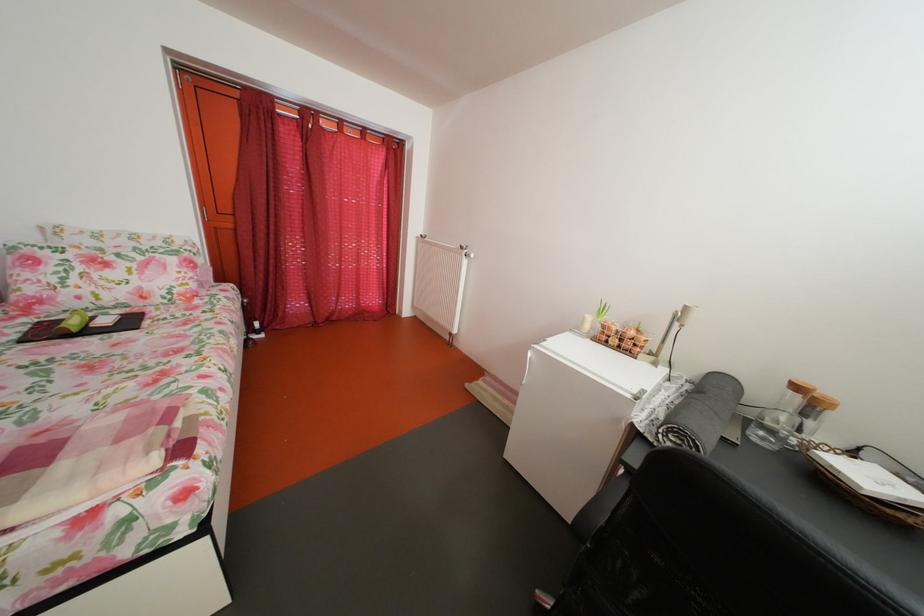
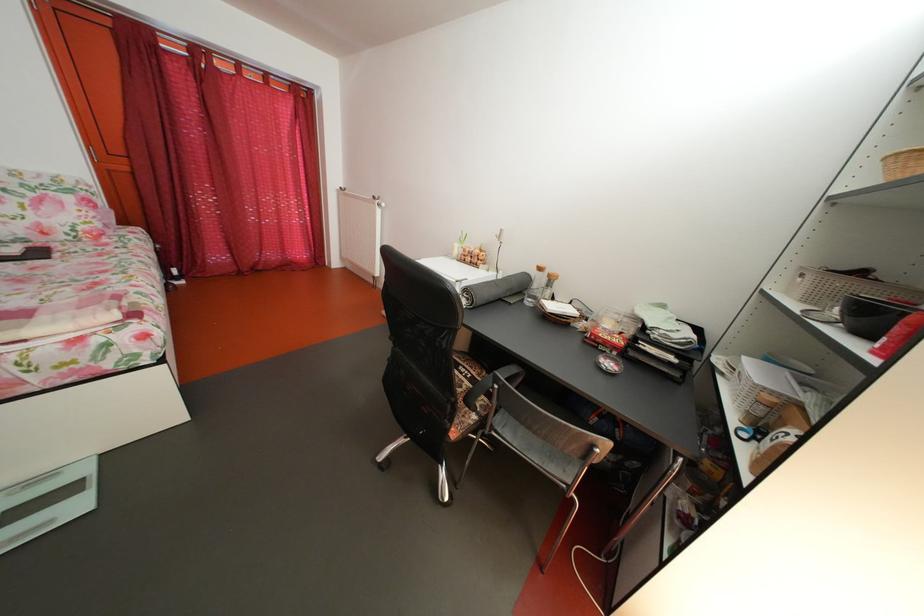
The images are taken continuously from a first-person perspective. In which direction are you moving?

The cameraman moved toward right, backward.